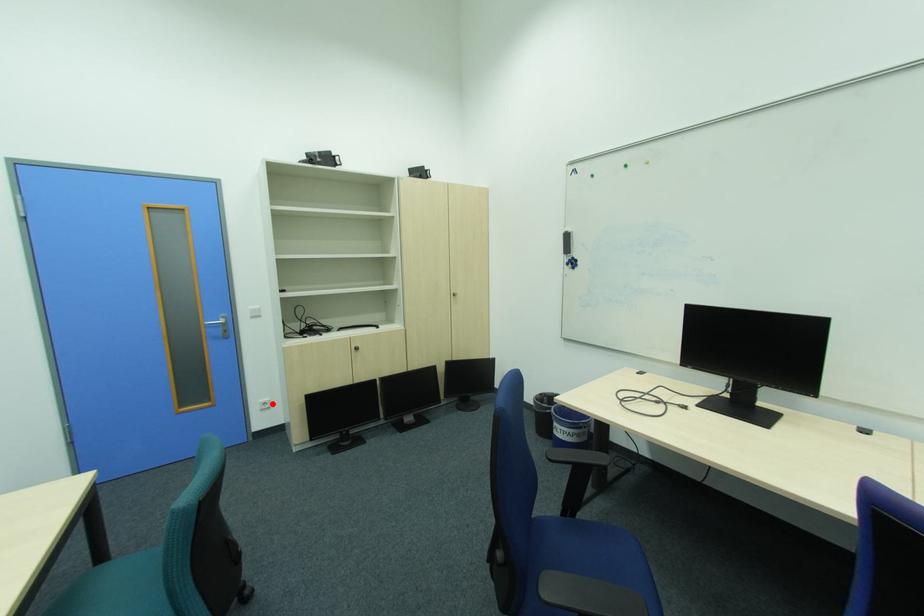
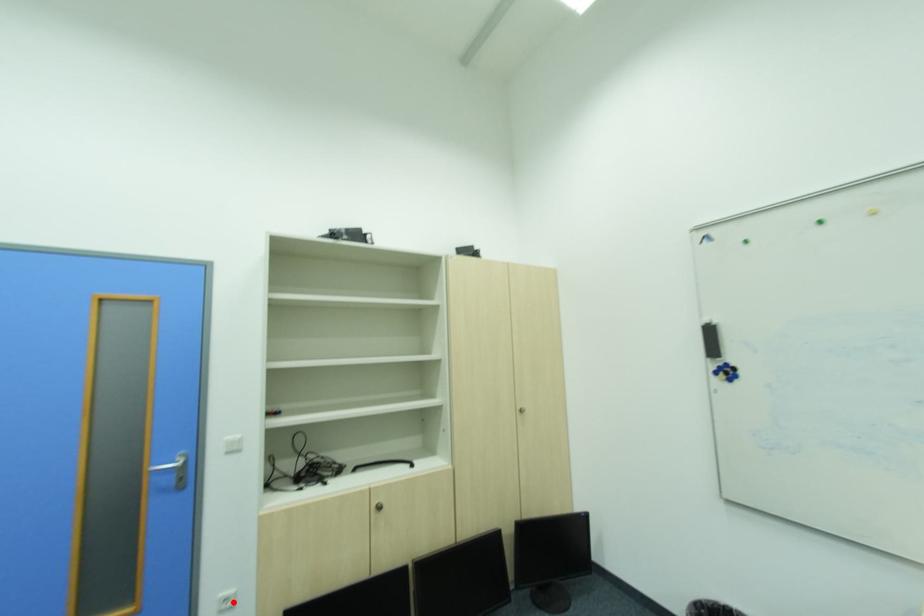
I am providing you with two images of the same scene from different viewpoints. A red point is marked on the first image and another point is marked on the second image. Do the highlighted points in image1 and image2 indicate the same real-world spot?

Yes